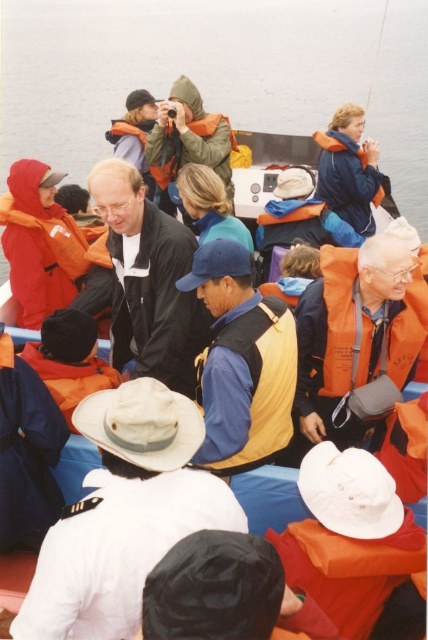
You are a photographer taking a picture of the matte black jacket at center and the orange fabric life jacket at right. Which object will appear larger in your photo?

The matte black jacket at center will appear larger in the photo because it is closer to the viewer than the orange fabric life jacket at right.

You are a safety inspector checking life jackets on a boat. You notice two life jackets, the orange life jacket at lower left and the blue fleece life jacket at upper right. Which one has a larger size?

The orange life jacket at lower left is bigger than the blue fleece life jacket at upper right.